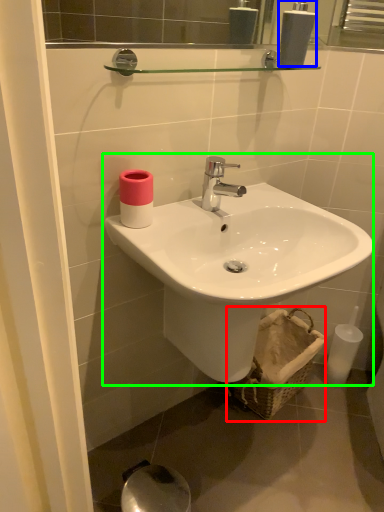
Question: Which object is positioned closest to basket (highlighted by a red box)? Select from soap dispenser (highlighted by a blue box) and sink (highlighted by a green box).

Choices:
 (A) soap dispenser
 (B) sink

Answer: (B)